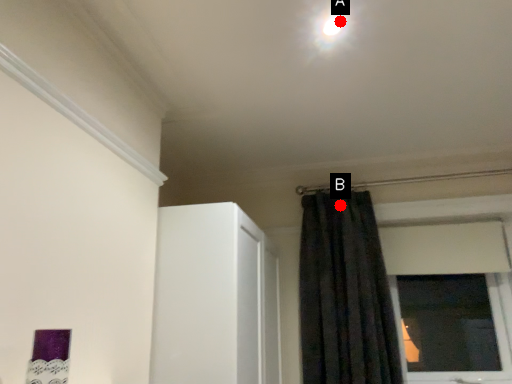
Question: Two points are circled on the image, labeled by A and B beside each circle. Which of the following is the farthest from the observer?

Choices:
 (A) A is further
 (B) B is further

Answer: (B)